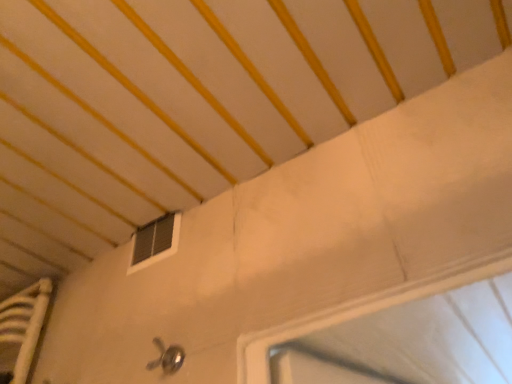
Question: Is point (148, 365) closer or farther from the camera than point (165, 213)?

Choices:
 (A) farther
 (B) closer

Answer: (B)

Question: From a real-world perspective, is polished metallic door handle at lower center positioned above or below black plastic window at upper center?

Choices:
 (A) below
 (B) above

Answer: (A)

Question: In terms of size, does polished metallic door handle at lower center appear bigger or smaller than black plastic window at upper center?

Choices:
 (A) big
 (B) small

Answer: (B)

Question: Based on their positions, is black plastic window at upper center located to the left or right of polished metallic door handle at lower center?

Choices:
 (A) left
 (B) right

Answer: (A)

Question: Is point (144, 266) positioned closer to the camera than point (158, 365)?

Choices:
 (A) closer
 (B) farther

Answer: (B)

Question: Is black plastic window at upper center inside or outside of polished metallic door handle at lower center?

Choices:
 (A) inside
 (B) outside

Answer: (B)

Question: From a real-world perspective, relative to polished metallic door handle at lower center, is black plastic window at upper center vertically above or below?

Choices:
 (A) above
 (B) below

Answer: (A)